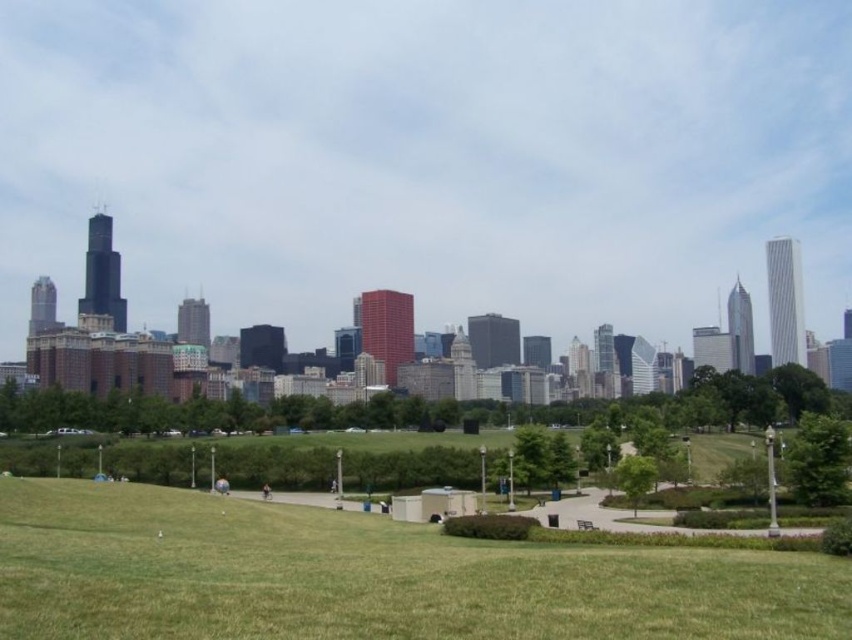
The image size is (852, 640). Describe the element at coordinates (369, 577) in the screenshot. I see `green grassy field at center` at that location.

Between point (427, 588) and point (222, 483), which one is positioned behind?

Point (222, 483)

The height and width of the screenshot is (640, 852). Find the location of `green grassy field at center`. green grassy field at center is located at coordinates (369, 577).

Does point (308, 129) lie behind point (220, 490)?

Yes, point (308, 129) is behind point (220, 490).

In the scene shown: Measure the distance between point (62, 51) and camera.

Point (62, 51) and camera are 2242.27 feet apart.

The width and height of the screenshot is (852, 640). In order to click on matte glass skyscrapers at upper center in this screenshot , I will do `click(429, 157)`.

Can you confirm if matte glass skyscrapers at upper center is positioned above dark blue jeans at center?

Indeed, matte glass skyscrapers at upper center is positioned over dark blue jeans at center.

Who is positioned more to the right, matte glass skyscrapers at upper center or dark blue jeans at center?

From the viewer's perspective, matte glass skyscrapers at upper center appears more on the right side.

Who is more forward, (337, 259) or (262, 493)?

Point (262, 493) is in front.

Where is `matte glass skyscrapers at upper center`? matte glass skyscrapers at upper center is located at coordinates (429, 157).